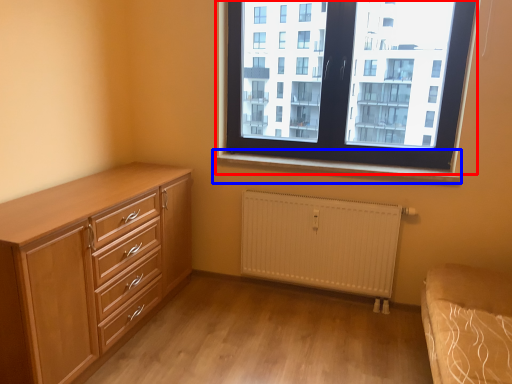
Question: Which of the following is the closest to the observer, window (highlighted by a red box) or window sill (highlighted by a blue box)?

Choices:
 (A) window
 (B) window sill

Answer: (A)